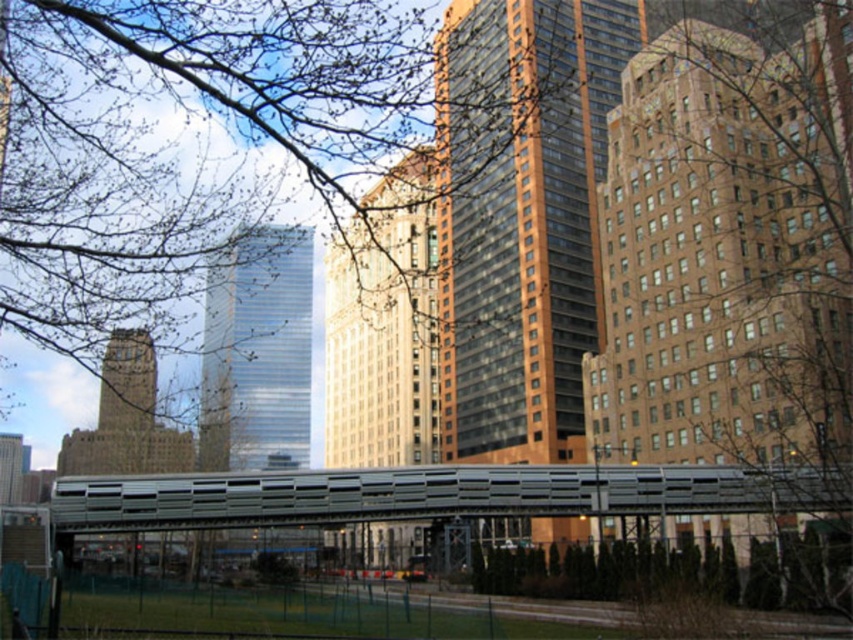
Question: Which object is positioned closest to the metallic gray bridge at center?

Choices:
 (A) green grass at lower center
 (B) bare branches at upper center
 (C) brown textured tree at center

Answer: (A)

Question: In this image, where is bare branches at upper center located relative to green grass at lower center?

Choices:
 (A) above
 (B) below

Answer: (A)

Question: Considering the real-world distances, which object is closest to the brown textured tree at center?

Choices:
 (A) metallic gray bridge at center
 (B) green grass at lower center
 (C) bare branches at upper center

Answer: (A)

Question: Can you confirm if brown textured tree at center is wider than bare branches at upper center?

Choices:
 (A) yes
 (B) no

Answer: (B)

Question: Which point is farther to the camera?

Choices:
 (A) click(x=666, y=266)
 (B) click(x=73, y=102)
 (C) click(x=706, y=508)

Answer: (A)

Question: Is bare branches at upper center above metallic gray bridge at center?

Choices:
 (A) no
 (B) yes

Answer: (B)